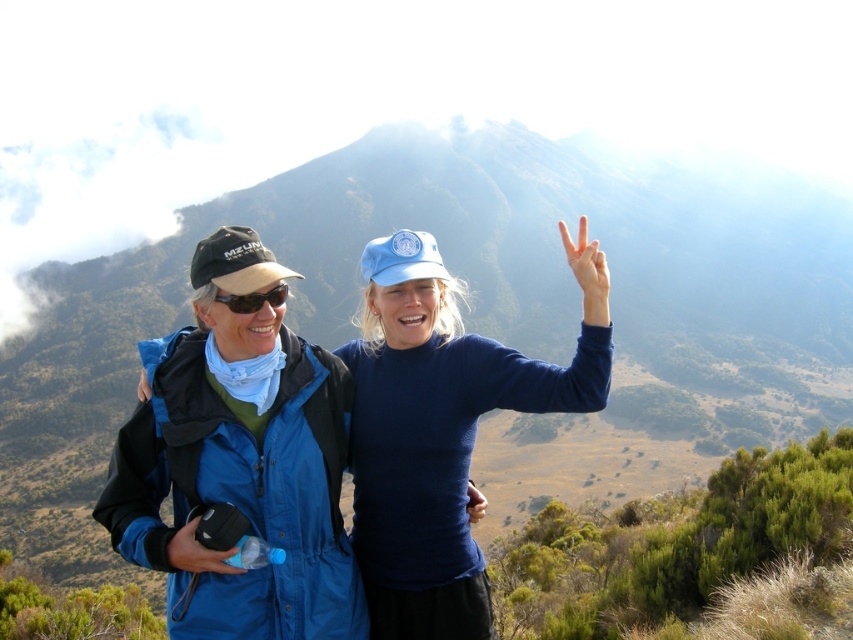
Question: Which of the following is the farthest from the observer?

Choices:
 (A) (462, 467)
 (B) (235, 298)

Answer: (A)

Question: From the image, what is the correct spatial relationship of blue fabric jacket at center in relation to matte black goggles at left?

Choices:
 (A) below
 (B) above

Answer: (A)

Question: Does blue fabric jacket at center have a larger size compared to matte black goggles at left?

Choices:
 (A) yes
 (B) no

Answer: (A)

Question: Is blue fabric jacket at center thinner than matte black goggles at left?

Choices:
 (A) yes
 (B) no

Answer: (B)